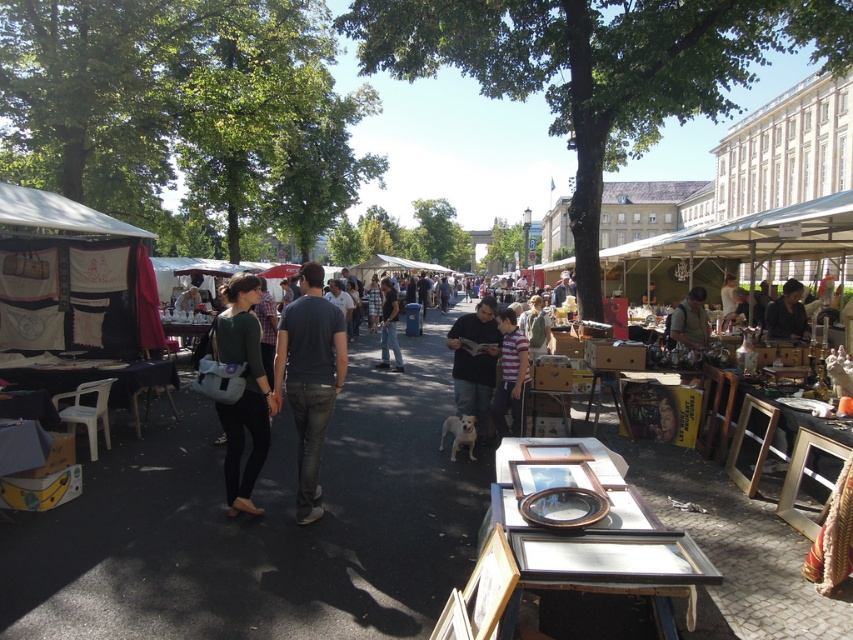
Question: Does matte black shirt at center have a larger size compared to dark brown leather jacket at center?

Choices:
 (A) no
 (B) yes

Answer: (B)

Question: Does striped cotton shirt at center appear on the right side of matte brown leather jacket at center?

Choices:
 (A) no
 (B) yes

Answer: (A)

Question: Which point appears closest to the camera in this image?

Choices:
 (A) (469, 356)
 (B) (334, 376)
 (C) (393, 294)

Answer: (B)

Question: Which of the following is the closest to the observer?

Choices:
 (A) (492, 324)
 (B) (770, 314)
 (C) (508, 358)

Answer: (C)

Question: Is green fabric backpack at center to the right of matte brown leather jacket at center from the viewer's perspective?

Choices:
 (A) yes
 (B) no

Answer: (B)

Question: Which of the following is the closest to the observer?

Choices:
 (A) green fabric backpack at center
 (B) matte black shirt at center

Answer: (A)